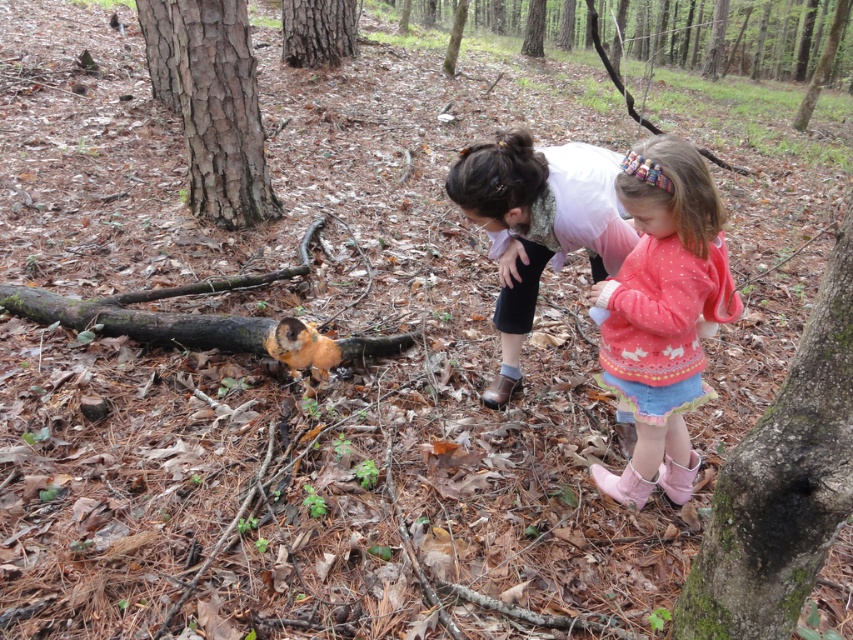
Is pink fabric at center closer to the viewer compared to brown rough log at lower left?

Yes, pink fabric at center is in front of brown rough log at lower left.

I want to click on pink fabric at center, so click(x=537, y=225).

Who is more forward, (532,202) or (113,308)?

Point (532,202)

This screenshot has width=853, height=640. In order to click on pink fabric at center in this screenshot , I will do `click(537, 225)`.

Which is in front, point (140, 339) or point (305, 17)?

Positioned in front is point (140, 339).

Is brown rough log at lower left wider than smooth brown bark at center?

Yes.

What do you see at coordinates (202, 328) in the screenshot? This screenshot has height=640, width=853. I see `brown rough log at lower left` at bounding box center [202, 328].

In order to click on brown rough log at lower left in this screenshot , I will do `click(202, 328)`.

Can you confirm if pink knitted sweater at center is thinner than brown rough bark tree at left?

Yes, pink knitted sweater at center is thinner than brown rough bark tree at left.

Is pink knitted sweater at center to the right of brown rough bark tree at left from the viewer's perspective?

Correct, you'll find pink knitted sweater at center to the right of brown rough bark tree at left.

The height and width of the screenshot is (640, 853). What do you see at coordinates (662, 312) in the screenshot? I see `pink knitted sweater at center` at bounding box center [662, 312].

This screenshot has height=640, width=853. Find the location of `pink knitted sweater at center`. pink knitted sweater at center is located at coordinates (662, 312).